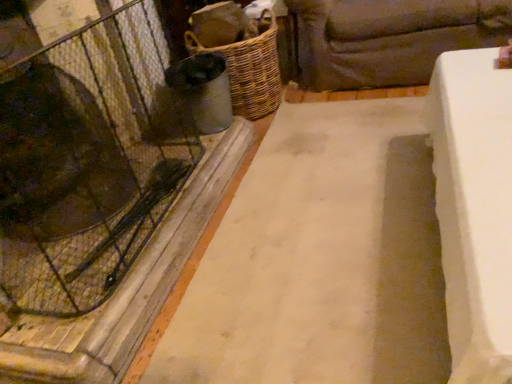
Question: Can you confirm if transparent glass door at left is bigger than white concrete slab at center?

Choices:
 (A) no
 (B) yes

Answer: (A)

Question: Is transparent glass door at left positioned behind white concrete slab at center?

Choices:
 (A) yes
 (B) no

Answer: (A)

Question: Is transparent glass door at left turned away from white concrete slab at center?

Choices:
 (A) yes
 (B) no

Answer: (B)

Question: Is transparent glass door at left wider than white concrete slab at center?

Choices:
 (A) yes
 (B) no

Answer: (B)

Question: Is transparent glass door at left positioned before white concrete slab at center?

Choices:
 (A) no
 (B) yes

Answer: (A)

Question: In the image, is dark brown fabric couch at upper right positioned in front of or behind transparent glass door at left?

Choices:
 (A) behind
 (B) front

Answer: (A)

Question: From a real-world perspective, relative to transparent glass door at left, is dark brown fabric couch at upper right vertically above or below?

Choices:
 (A) below
 (B) above

Answer: (A)

Question: Is dark brown fabric couch at upper right inside the boundaries of transparent glass door at left, or outside?

Choices:
 (A) outside
 (B) inside

Answer: (A)

Question: Does point (395, 69) appear closer or farther from the camera than point (121, 34)?

Choices:
 (A) farther
 (B) closer

Answer: (A)

Question: From the image's perspective, is transparent glass door at left positioned above or below woven brown basket at center-left?

Choices:
 (A) below
 (B) above

Answer: (A)

Question: Considering their positions, is transparent glass door at left located in front of or behind woven brown basket at center-left?

Choices:
 (A) front
 (B) behind

Answer: (A)

Question: Is transparent glass door at left wider or thinner than woven brown basket at center-left?

Choices:
 (A) thin
 (B) wide

Answer: (A)

Question: Would you say transparent glass door at left is inside or outside woven brown basket at center-left?

Choices:
 (A) outside
 (B) inside

Answer: (A)

Question: Is point (262, 187) closer or farther from the camera than point (274, 23)?

Choices:
 (A) closer
 (B) farther

Answer: (A)

Question: Is white concrete slab at center taller or shorter than woven brown basket at center-left?

Choices:
 (A) short
 (B) tall

Answer: (A)